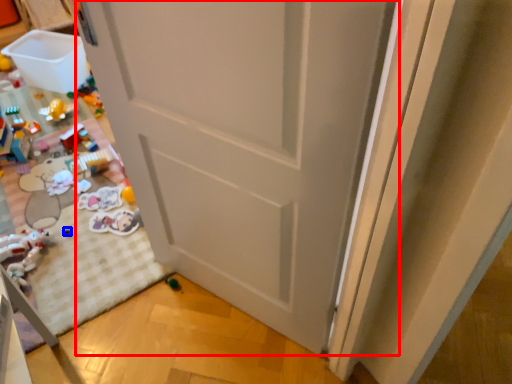
Question: Which point is further to the camera, door (highlighted by a red box) or toy (highlighted by a blue box)?

Choices:
 (A) door
 (B) toy

Answer: (B)